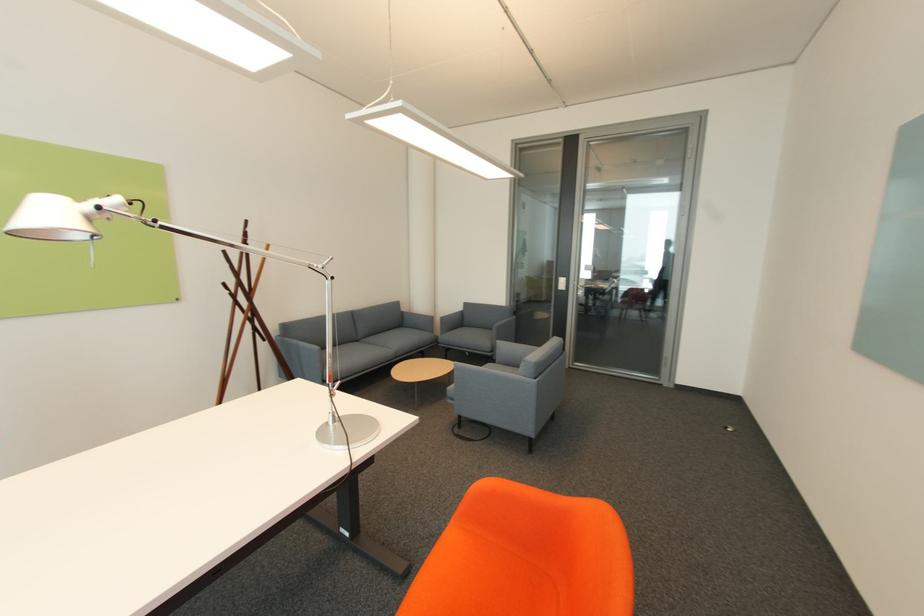
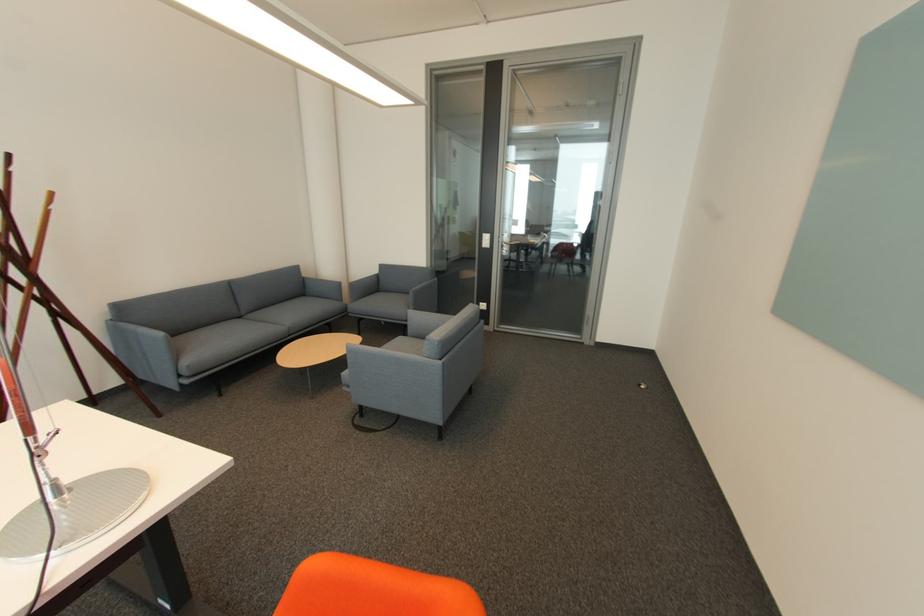
Locate, in the second image, the point that corresponds to point (444, 337) in the first image.

(353, 305)